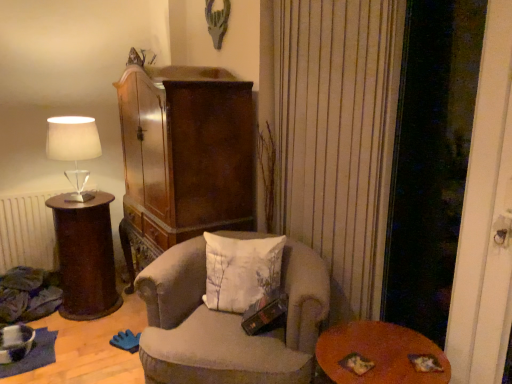
Question: Considering the relative sizes of velvet beige armchair at center and wooden round table at lower right in the image provided, is velvet beige armchair at center taller than wooden round table at lower right?

Choices:
 (A) no
 (B) yes

Answer: (B)

Question: Considering the relative positions of velvet beige armchair at center and wooden round table at lower right in the image provided, is velvet beige armchair at center to the left of wooden round table at lower right from the viewer's perspective?

Choices:
 (A) yes
 (B) no

Answer: (A)

Question: Can you confirm if velvet beige armchair at center is positioned to the right of wooden round table at lower right?

Choices:
 (A) yes
 (B) no

Answer: (B)

Question: Is velvet beige armchair at center thinner than wooden round table at lower right?

Choices:
 (A) yes
 (B) no

Answer: (B)

Question: From the image's perspective, is velvet beige armchair at center on top of wooden round table at lower right?

Choices:
 (A) yes
 (B) no

Answer: (A)

Question: Looking at their shapes, would you say white fabric lampshade at left is wider or thinner than brown wood side table at left?

Choices:
 (A) thin
 (B) wide

Answer: (A)

Question: From the image's perspective, relative to brown wood side table at left, is white fabric lampshade at left above or below?

Choices:
 (A) below
 (B) above

Answer: (B)

Question: From a real-world perspective, is white fabric lampshade at left positioned above or below brown wood side table at left?

Choices:
 (A) below
 (B) above

Answer: (B)

Question: Is point (54, 142) positioned closer to the camera than point (98, 289)?

Choices:
 (A) farther
 (B) closer

Answer: (B)

Question: From a real-world perspective, is wooden round table at lower right above or below white fabric lampshade at left?

Choices:
 (A) below
 (B) above

Answer: (A)

Question: Based on their positions, is wooden round table at lower right located to the left or right of white fabric lampshade at left?

Choices:
 (A) left
 (B) right

Answer: (B)

Question: From the image's perspective, is wooden round table at lower right positioned above or below white fabric lampshade at left?

Choices:
 (A) above
 (B) below

Answer: (B)

Question: Is wooden round table at lower right inside or outside of white fabric lampshade at left?

Choices:
 (A) outside
 (B) inside

Answer: (A)

Question: From the image's perspective, is brown wood side table at left located above or below white cotton pillow at center?

Choices:
 (A) below
 (B) above

Answer: (A)

Question: From a real-world perspective, is brown wood side table at left above or below white cotton pillow at center?

Choices:
 (A) below
 (B) above

Answer: (A)